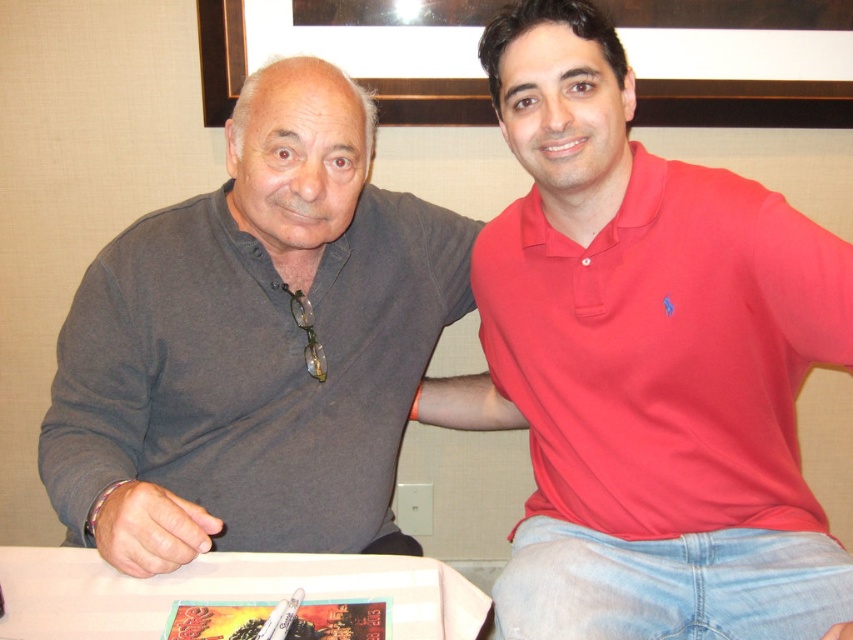
Question: Can you confirm if red cotton polo shirt at center is bigger than white paper at center?

Choices:
 (A) yes
 (B) no

Answer: (A)

Question: Is matte gray sweater at left smaller than wooden picture frame at upper center?

Choices:
 (A) no
 (B) yes

Answer: (A)

Question: Based on their relative distances, which object is nearer to the white paper at center?

Choices:
 (A) wooden picture frame at upper center
 (B) red cotton polo shirt at center

Answer: (B)

Question: Which object appears farthest from the camera in this image?

Choices:
 (A) white paper at center
 (B) wooden picture frame at upper center

Answer: (B)

Question: Is matte gray sweater at left wider than wooden picture frame at upper center?

Choices:
 (A) yes
 (B) no

Answer: (A)

Question: Which is nearer to the red cotton polo shirt at center?

Choices:
 (A) white paper at center
 (B) matte gray sweater at left

Answer: (B)